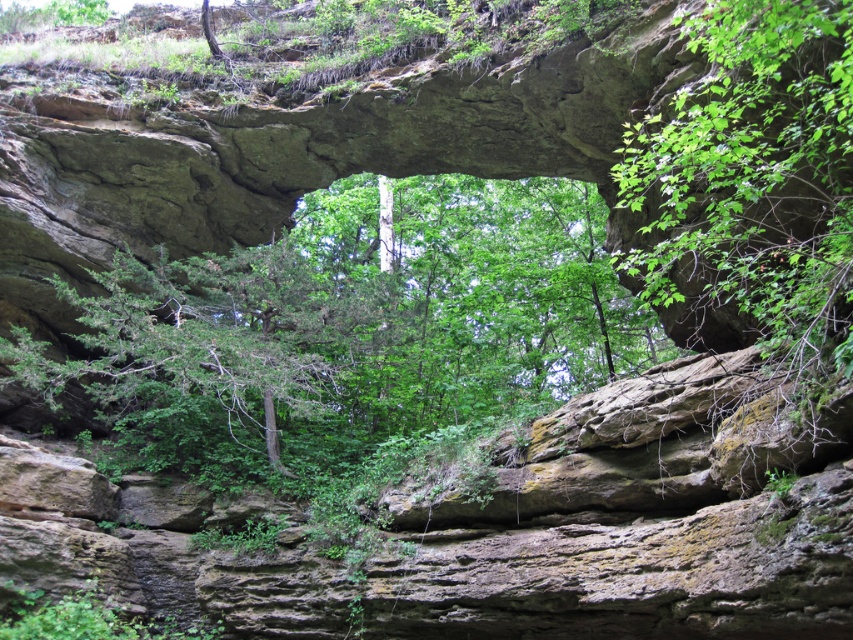
Which is below, green leafy tree at center or green leafy tree at upper right?

green leafy tree at upper right

Between green leafy tree at center and green leafy tree at upper right, which one appears on the left side from the viewer's perspective?

green leafy tree at center

Where is `green leafy tree at center`? Image resolution: width=853 pixels, height=640 pixels. green leafy tree at center is located at coordinates (357, 328).